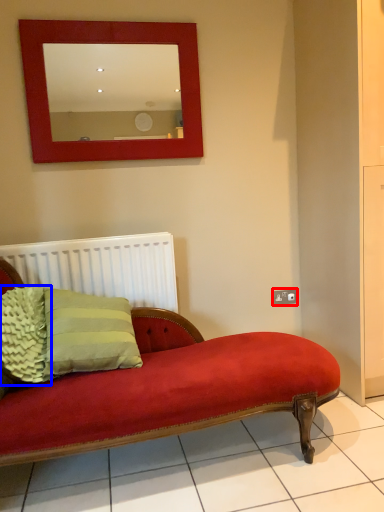
Question: Which object is closer to the camera taking this photo, electric outlet (highlighted by a red box) or pillow (highlighted by a blue box)?

Choices:
 (A) electric outlet
 (B) pillow

Answer: (B)